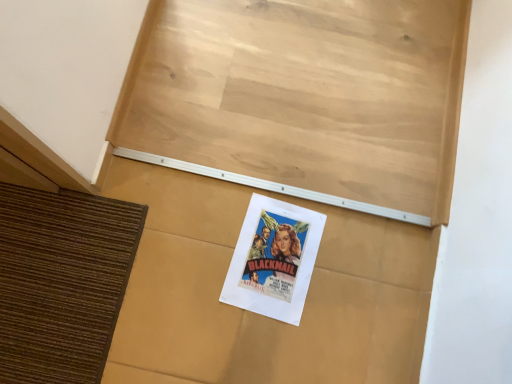
Image resolution: width=512 pixels, height=384 pixels. What are the coordinates of `free space to the left of white paper poster at center` in the screenshot? It's located at (115, 227).